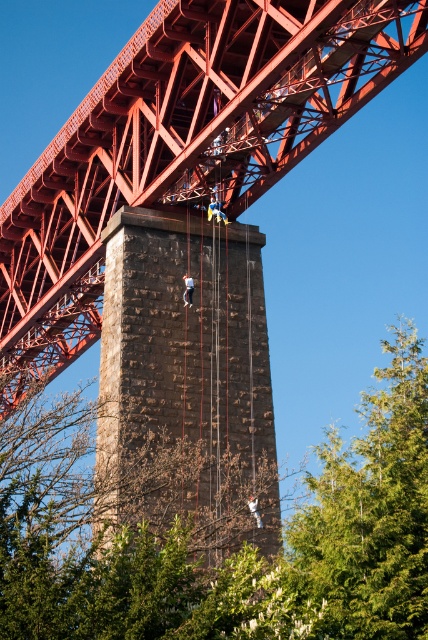
You are a park visitor standing at the base of the brown rough stone tower at center. You notice a green leafy tree at center nearby. Which direction should you walk to reach the tree without going under the tower?

The green leafy tree at center is positioned under the brown rough stone tower at center, so you should walk away from the tower to reach the tree without going under it.

You are a maintenance worker standing on the red painted steel bridge at upper center and need to reach the brown rough stone tower at center for inspection. Which object is closer to your current position?

The red painted steel bridge at upper center is closer to the viewer than the brown rough stone tower at center, so the bridge is closer to your current position.